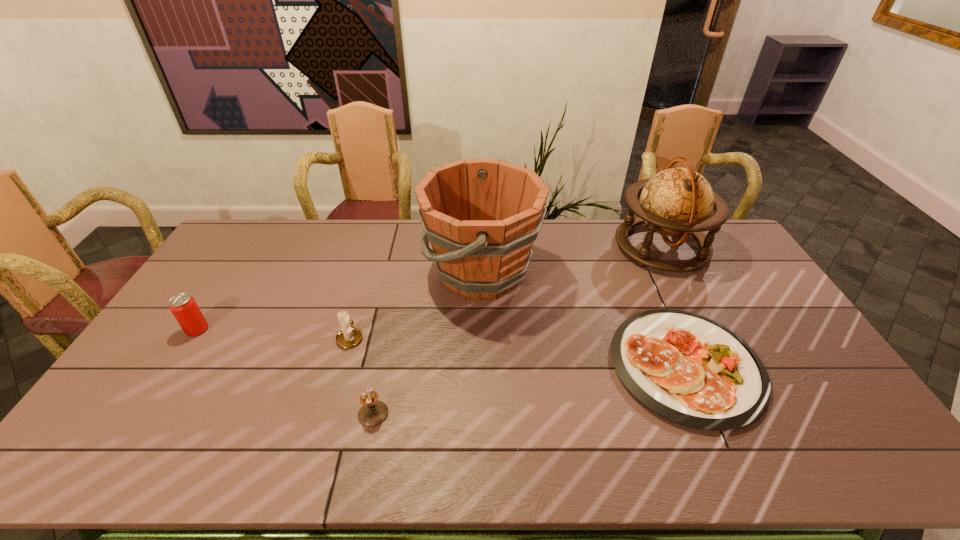
Identify the location of globe. This screenshot has height=540, width=960. (676, 202).

Image resolution: width=960 pixels, height=540 pixels. I want to click on bucket, so click(481, 216).

What are the coordinates of `the leftmost object` in the screenshot? It's located at (183, 306).

Where is `the farther candle holder`? This screenshot has width=960, height=540. the farther candle holder is located at coordinates (349, 336).

Find the location of a particular element. The width and height of the screenshot is (960, 540). the fifth object from right to left is located at coordinates (349, 336).

Identify the location of the fourth object from right to left. (373, 412).

Where is `the nearer candle holder`? The image size is (960, 540). the nearer candle holder is located at coordinates (373, 412).

You are a GUI agent. You are given a task and a screenshot of the screen. Output one action in this format:
    pyautogui.click(x=<x>, y=<y>)
    Task: Click on the shortest object
    This screenshot has width=960, height=540.
    Given the screenshot: What is the action you would take?
    pyautogui.click(x=689, y=369)

At what (x,y) coordinates should I click in order to perform the action: click on vacant space located on the front of the globe. Please return your answer as a coordinate pair (x, y). Looking at the image, I should click on (689, 301).

The width and height of the screenshot is (960, 540). What are the coordinates of `vacant space located 0.180m on the handle side of the bucket` in the screenshot? It's located at (372, 273).